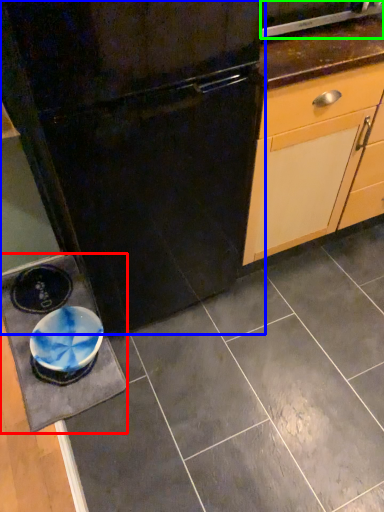
Question: Based on their relative distances, which object is farther from slate (highlighted by a red box)? Choose from refrigerator (highlighted by a blue box) and home appliance (highlighted by a green box).

Choices:
 (A) refrigerator
 (B) home appliance

Answer: (B)